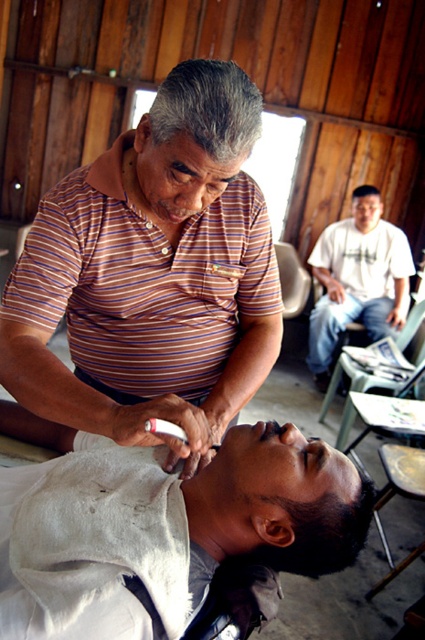
Is point (402, 244) positioned behind point (334, 384)?

That is True.

Does white cotton shirt at upper right appear on the right side of metallic gray chair at center?

Indeed, white cotton shirt at upper right is positioned on the right side of metallic gray chair at center.

Which is behind, point (376, 301) or point (346, 433)?

Positioned behind is point (376, 301).

You are a GUI agent. You are given a task and a screenshot of the screen. Output one action in this format:
    pyautogui.click(x=<x>, y=<y>)
    Task: Click on the white cotton shirt at upper right
    
    Given the screenshot: What is the action you would take?
    pyautogui.click(x=357, y=280)

Which is below, white cloth at lower center or white cotton shirt at upper right?

white cloth at lower center is lower down.

Between point (82, 474) and point (353, 211), which one is positioned behind?

Positioned behind is point (353, 211).

Between point (73, 612) and point (325, 250), which one is positioned in front?

Point (73, 612) is in front.

Where is `white cloth at lower center`? white cloth at lower center is located at coordinates [167, 531].

Does striped cotton shirt at center have a lesser width compared to metallic gray chair at center?

Incorrect, striped cotton shirt at center's width is not less than metallic gray chair at center's.

Is point (212, 144) positioned in front of point (401, 348)?

Yes, it is.

Identify the location of striped cotton shirt at center. This screenshot has width=425, height=640. (153, 275).